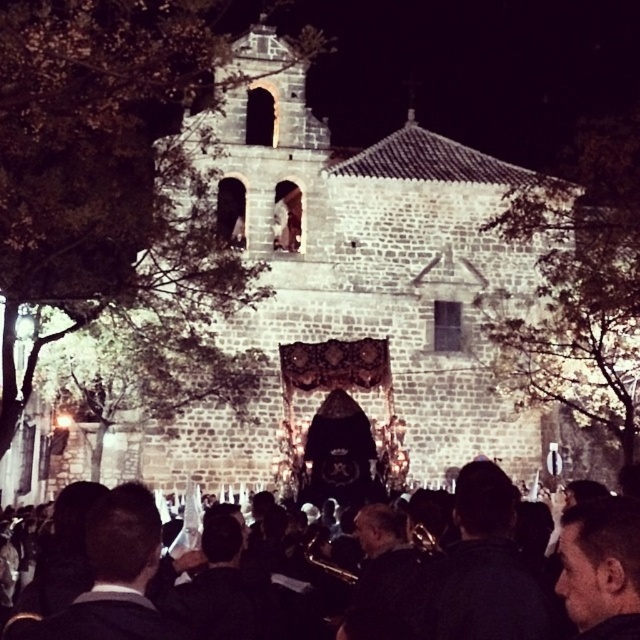
Can you confirm if stone church at center is positioned to the left of black fabric crowd at lower center?

Yes, stone church at center is to the left of black fabric crowd at lower center.

Which is in front, point (289, 180) or point (504, 609)?

Point (504, 609)

The image size is (640, 640). Find the location of `stone church at center`. stone church at center is located at coordinates (364, 291).